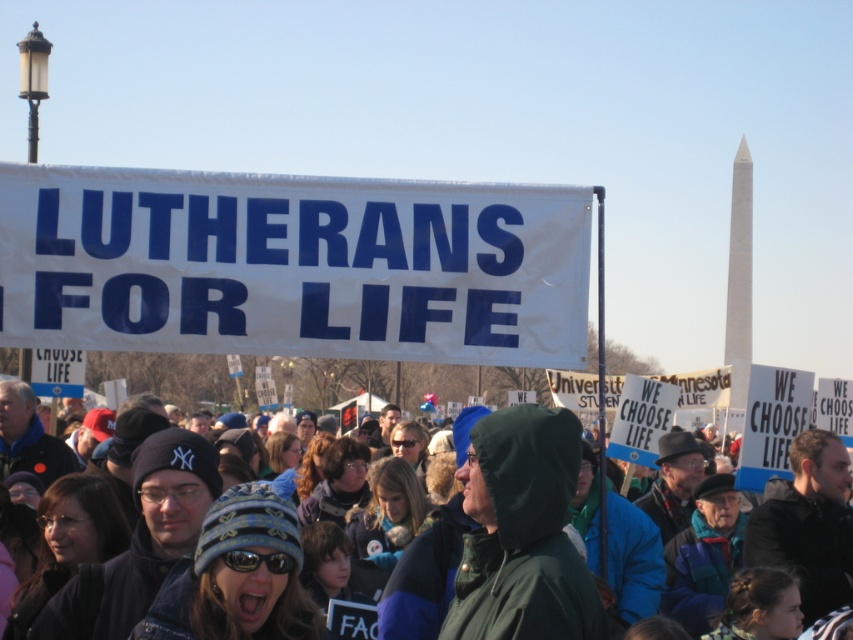
You are a photographer standing at the origin point of the image. The white paper banner at center is located at coordinates point 0.416, 0.343. If you want to capture the banner in your frame, which direction should you move to center it? Please provide your answer in terms of x and y coordinates relative to your current position.

The white paper banner at center is located at coordinates point (292, 266). To center it, you should move in the positive x and positive y direction to align with the banner.

You are a photographer trying to capture the white paper banner at center and the green hooded jacket at center in the same frame. Based on their sizes, which one appears smaller in the photo?

The white paper banner at center appears smaller in the photo because it has a lesser height compared to the green hooded jacket at center.